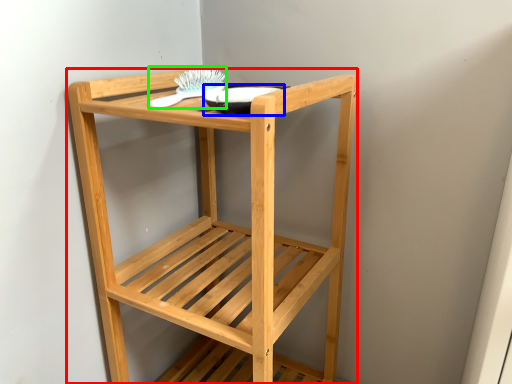
Question: Estimate the real-world distances between objects in this image. Which object is closer to furniture (highlighted by a red box), glass bowl (highlighted by a blue box) or brush (highlighted by a green box)?

Choices:
 (A) glass bowl
 (B) brush

Answer: (A)